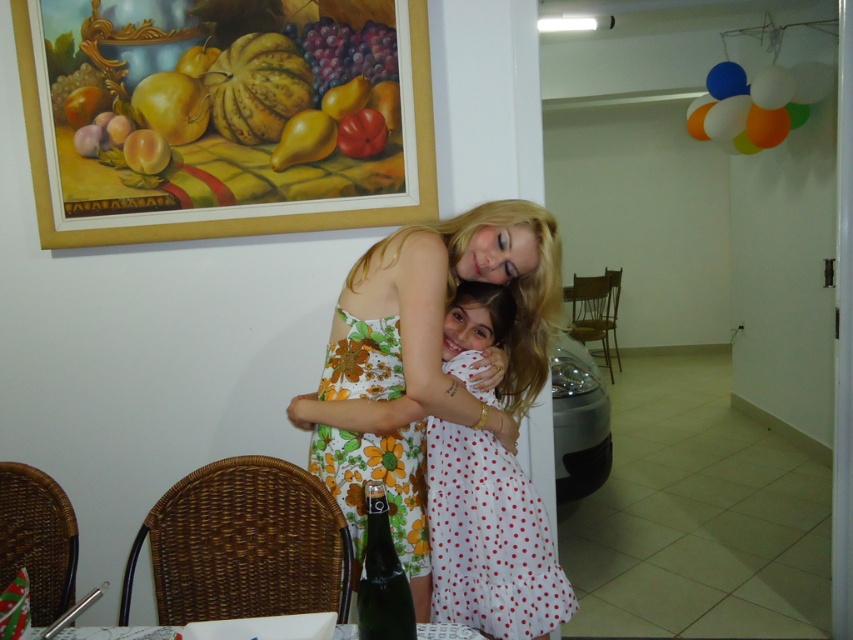
Question: Which point appears closest to the camera in this image?

Choices:
 (A) (433, 156)
 (B) (378, 148)
 (C) (409, 600)
 (D) (125, 45)

Answer: (C)

Question: Does white dotted dress at center have a lesser width compared to green glass bottle at lower center?

Choices:
 (A) yes
 (B) no

Answer: (B)

Question: Is floral dress at center bigger than shiny red tomato at upper center?

Choices:
 (A) no
 (B) yes

Answer: (B)

Question: Which of the following is the closest to the observer?

Choices:
 (A) (368, 500)
 (B) (351, 470)
 (C) (393, 40)

Answer: (A)

Question: Is floral print fabric dress at center to the right of wooden frame at upper left from the viewer's perspective?

Choices:
 (A) no
 (B) yes

Answer: (B)

Question: Which point is farther to the camera?

Choices:
 (A) (346, 120)
 (B) (280, 154)
 (C) (511, 579)

Answer: (B)